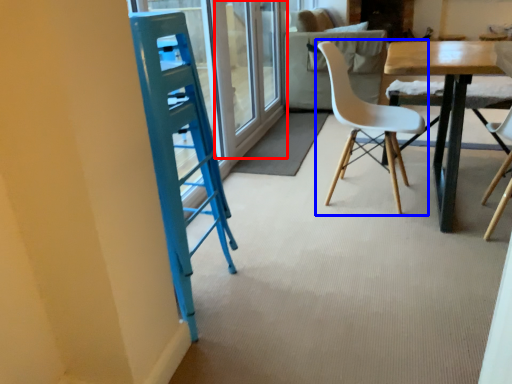
Question: Which point is further to the camera, screen door (highlighted by a red box) or chair (highlighted by a blue box)?

Choices:
 (A) screen door
 (B) chair

Answer: (A)